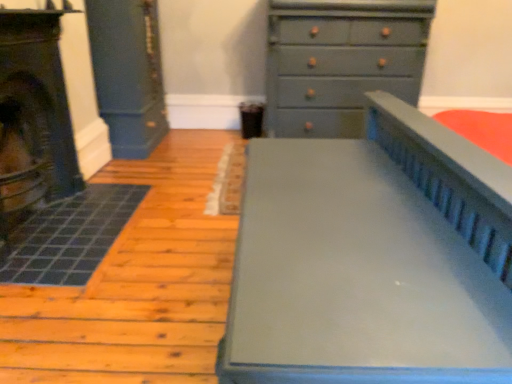
Question: Considering the positions of point (0, 180) and point (311, 82), is point (0, 180) closer or farther from the camera than point (311, 82)?

Choices:
 (A) closer
 (B) farther

Answer: (A)

Question: In terms of size, does matte black fireplace at left appear bigger or smaller than matte gray chest of drawers at upper right?

Choices:
 (A) small
 (B) big

Answer: (A)

Question: Based on their relative distances, which object is farther from the matte black fireplace at left?

Choices:
 (A) matte gray chest of drawers at upper right
 (B) matte gray bed at center

Answer: (A)

Question: Which object is positioned closest to the matte gray chest of drawers at upper right?

Choices:
 (A) matte black fireplace at left
 (B) matte gray bed at center

Answer: (B)